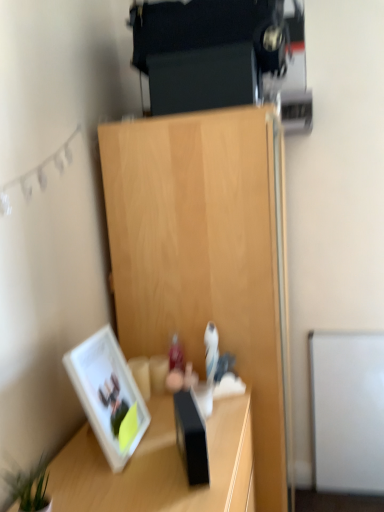
Identify the location of vacant space that is to the left of white glossy picture frame at lower left. (72, 450).